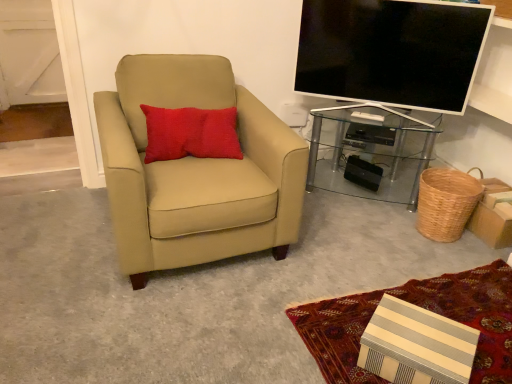
Find the location of `vacant space to the right of beige leather chair at left`. vacant space to the right of beige leather chair at left is located at coordinates (347, 243).